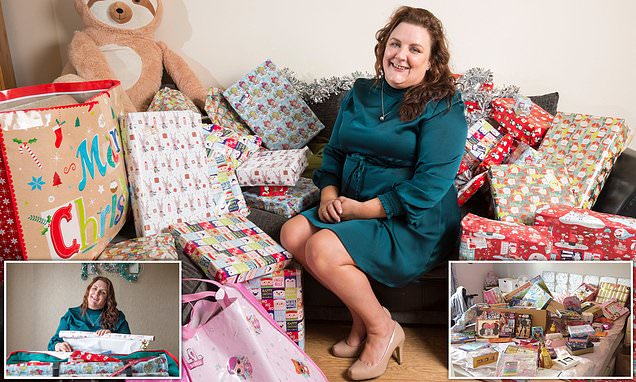
The height and width of the screenshot is (382, 636). I want to click on stuffed sloth, so click(128, 45).